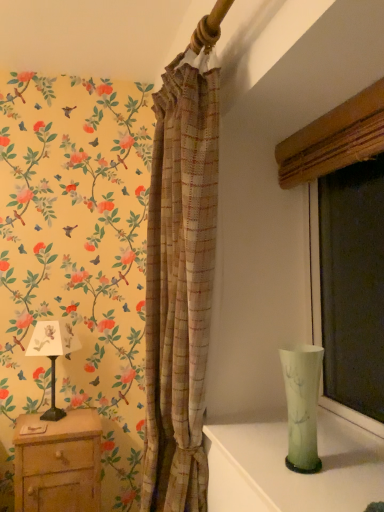
Identify the location of free space in front of white paper lampshade at left. Image resolution: width=384 pixels, height=512 pixels. (49, 432).